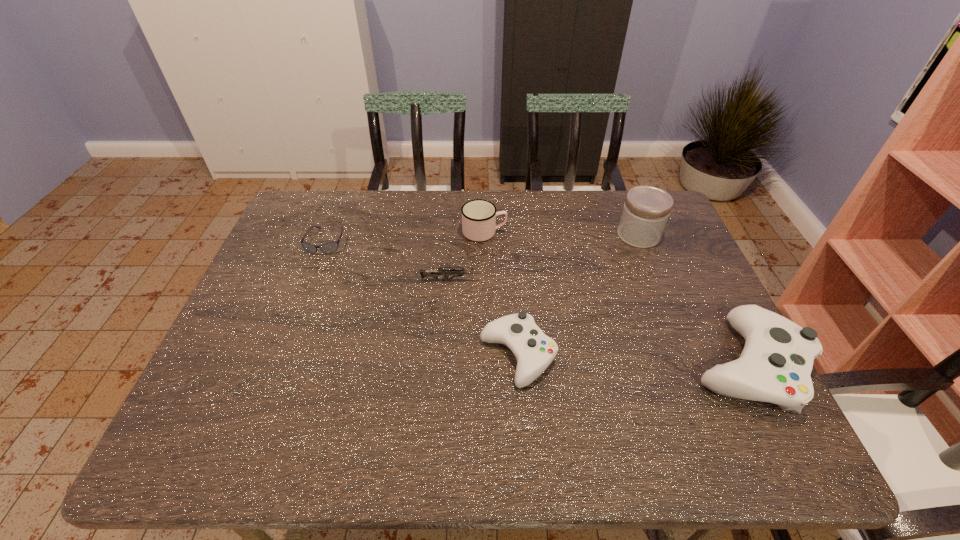
Image resolution: width=960 pixels, height=540 pixels. I want to click on the shorter control, so click(534, 351).

Find the location of a particular element. This screenshot has width=960, height=540. the left control is located at coordinates (534, 351).

This screenshot has height=540, width=960. In order to click on the taller control in this screenshot , I will do `click(775, 365)`.

Identify the location of mug. (478, 216).

Locate an element on the screen. jar is located at coordinates (646, 210).

The height and width of the screenshot is (540, 960). Identify the location of the shortest object. (327, 248).

What are the coordinates of `the leftmost object` in the screenshot? It's located at (327, 248).

Locate an element on the screen. The width and height of the screenshot is (960, 540). the fourth farthest object is located at coordinates (424, 273).

The width and height of the screenshot is (960, 540). I want to click on gun, so click(424, 273).

Find the location of `vacant space located 0.290m on the right of the shorter control`. vacant space located 0.290m on the right of the shorter control is located at coordinates (677, 356).